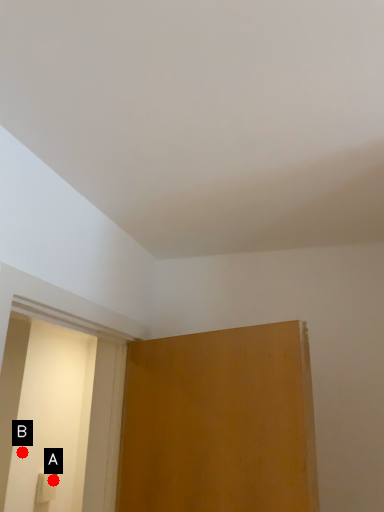
Question: Two points are circled on the image, labeled by A and B beside each circle. Which point is further to the camera?

Choices:
 (A) A is further
 (B) B is further

Answer: (A)